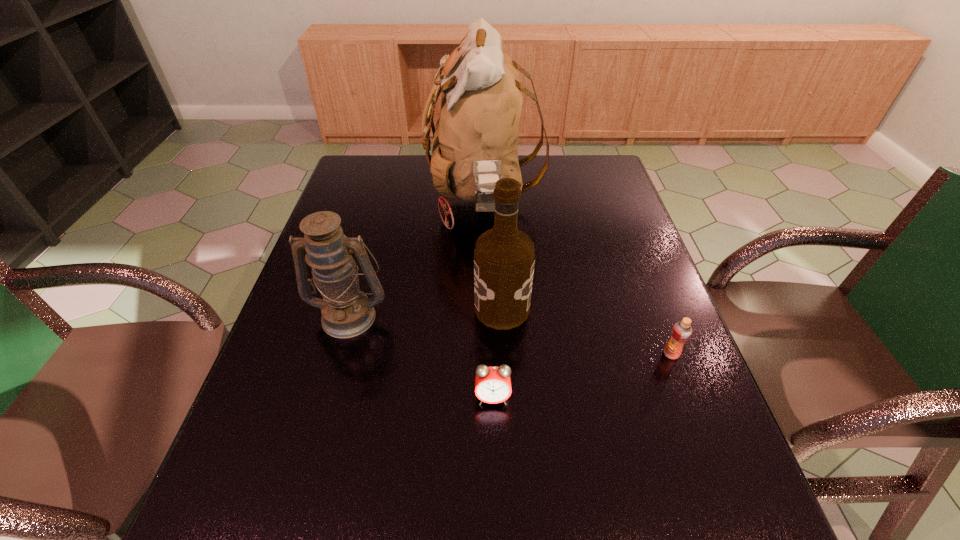
Find the location of a particular element. The image size is (960, 540). blank space located on the front-facing side of the farthest object is located at coordinates (371, 202).

Locate an element on the screen. The image size is (960, 540). vacant point located on the front-facing side of the farthest object is located at coordinates (390, 202).

Locate an element on the screen. The width and height of the screenshot is (960, 540). vacant position located 0.340m on the label of the alcohol is located at coordinates (333, 308).

The height and width of the screenshot is (540, 960). Find the location of `free location located 0.050m on the label of the alcohol`. free location located 0.050m on the label of the alcohol is located at coordinates (454, 308).

Where is `free space located 0.150m on the label of the alcohol`? This screenshot has height=540, width=960. free space located 0.150m on the label of the alcohol is located at coordinates (412, 308).

Locate an element on the screen. This screenshot has height=540, width=960. free space located on the left of the leftmost object is located at coordinates (289, 315).

The width and height of the screenshot is (960, 540). I want to click on free space located on the back of the fourth farthest object, so (x=660, y=326).

Locate an element on the screen. vacant space situated on the front-facing side of the nearest object is located at coordinates (495, 511).

You are a GUI agent. You are given a task and a screenshot of the screen. Output one action in this format:
    pyautogui.click(x=<x>, y=<y>)
    Task: Click on the object that is positioned at the far edge
    
    Given the screenshot: What is the action you would take?
    pyautogui.click(x=475, y=144)

This screenshot has width=960, height=540. I want to click on object situated at the left edge, so click(x=346, y=311).